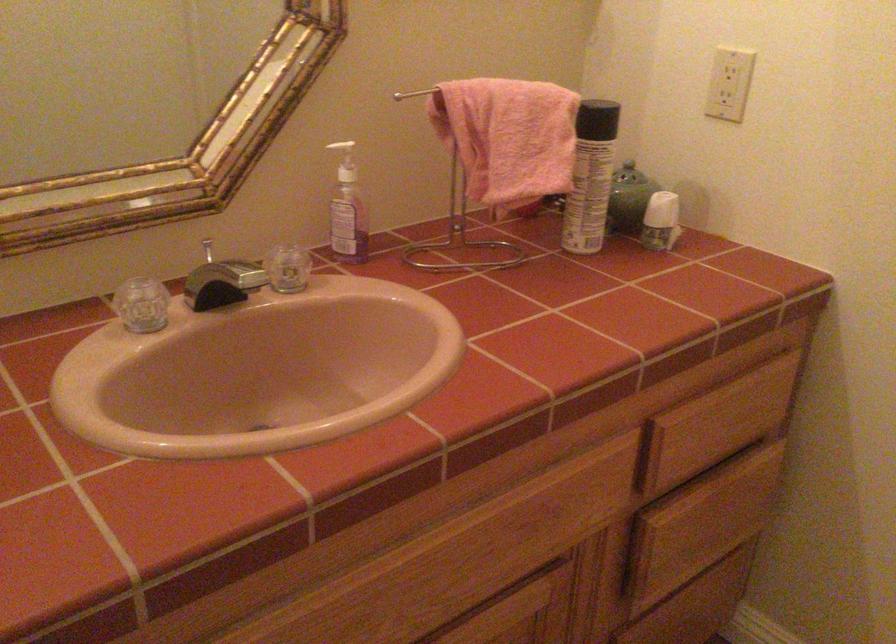
Find where to pull the faucet drain lever. Please return your answer as a coordinate pair (x, y).

(208, 250)